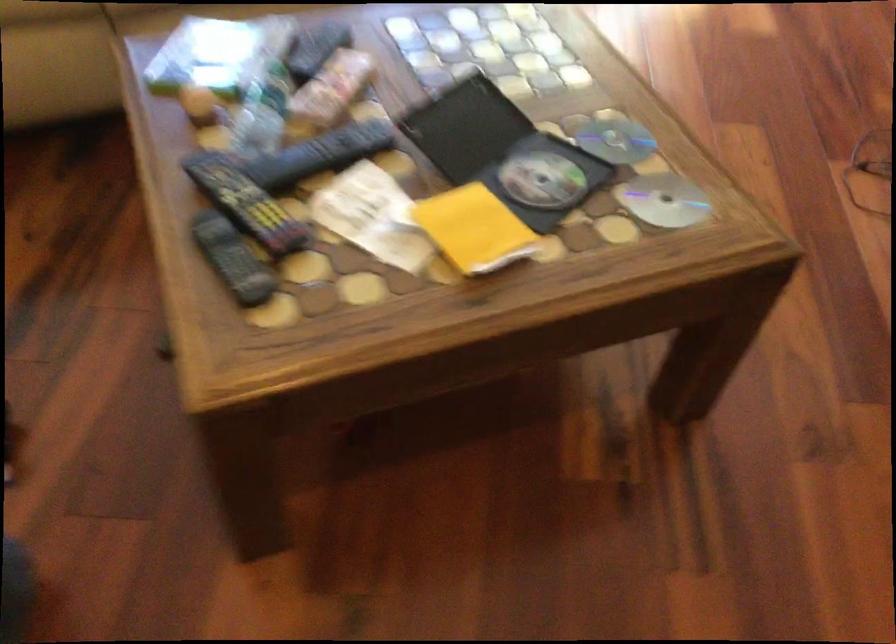
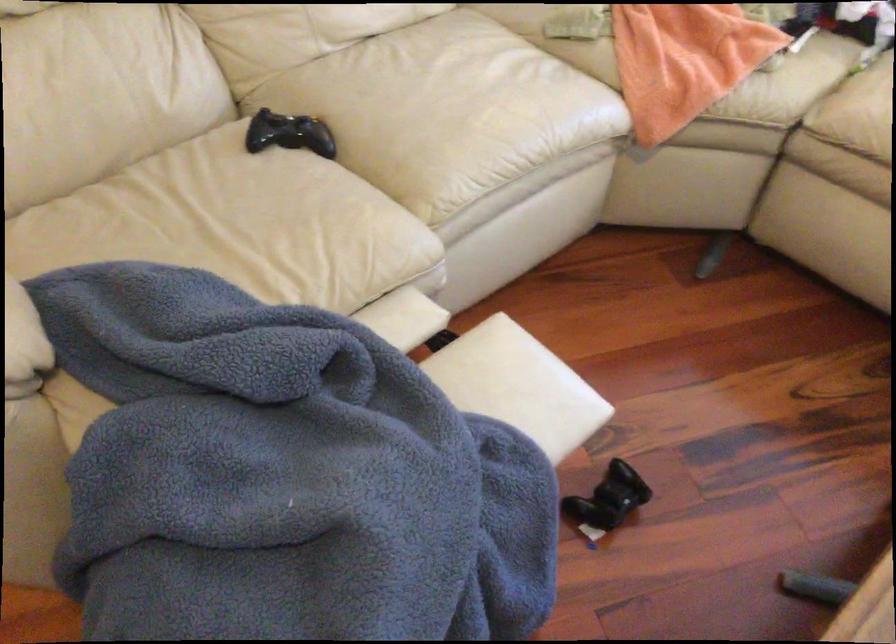
Question: How did the camera likely rotate?

Choices:
 (A) Left
 (B) Right
 (C) Up
 (D) Down

Answer: (A)